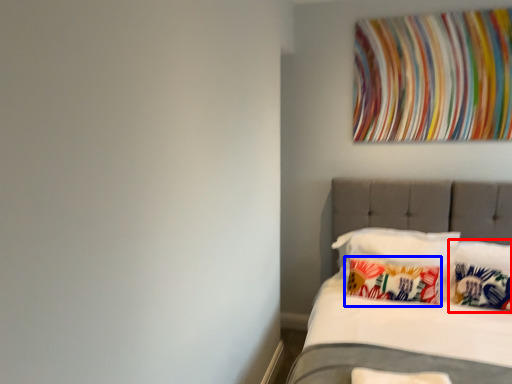
Question: Which of the following is the closest to the observer, pillow (highlighted by a red box) or pillow (highlighted by a blue box)?

Choices:
 (A) pillow
 (B) pillow

Answer: (A)